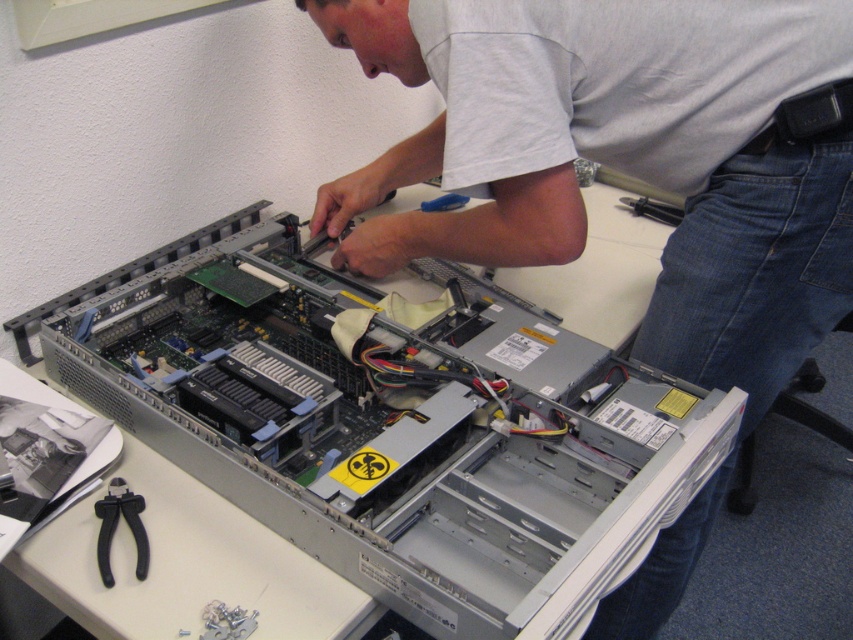
You are a technician trying to access the internal components of the silver metallic server at center and the gray matte computer case at center. Which one do you need to move first to get a better view of its interior?

The silver metallic server at center is closer to the viewer than the gray matte computer case at center, so you should move the gray matte computer case at center first to get a better view of its interior.

You are a technician working on the silver metallic server at center and need to place the black plastic pliers at lower left next to it. Considering their sizes, will the pliers fit on the table without overlapping the server?

The silver metallic server at center is much taller than the black plastic pliers at lower left. Since the server is taller, it might occupy more vertical space, but the pliers are smaller in size, so they should fit on the table next to the server without overlapping.

You are a technician who needs to reach both the gray matte computer case at center and the black plastic pliers at lower left. Given that your arms can comfortably reach items within 28 inches, can you comfortably reach both items without moving your chair?

The distance between the gray matte computer case at center and the black plastic pliers at lower left is 27.50 inches, which is within your comfortable reach range of 28 inches. Therefore, you can comfortably reach both items without moving your chair.